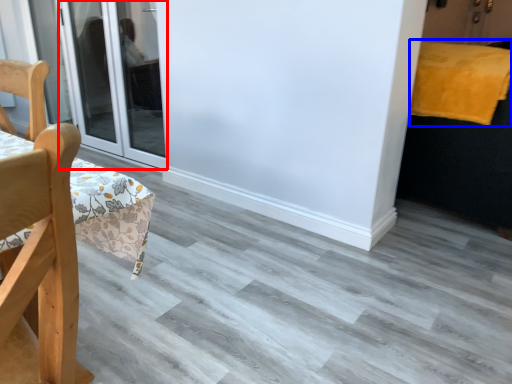
Question: Which of the following is the farthest to the observer, door (highlighted by a red box) or blanket (highlighted by a blue box)?

Choices:
 (A) door
 (B) blanket

Answer: (A)